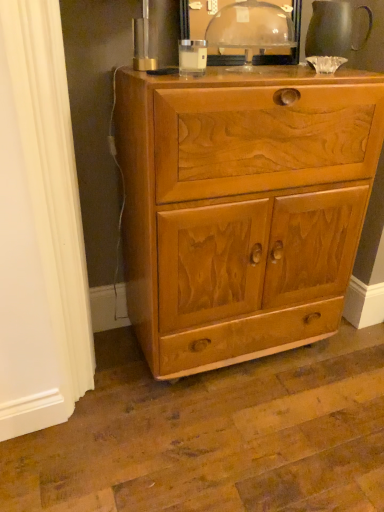
You are a GUI agent. You are given a task and a screenshot of the screen. Output one action in this format:
    pyautogui.click(x=<x>, y=<y>)
    Task: Click on the free space in front of matte gray pitcher at upper right
    
    Given the screenshot: What is the action you would take?
    pyautogui.click(x=348, y=71)